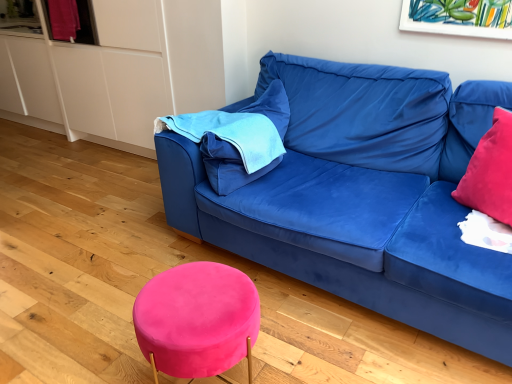
Question: Considering the relative sizes of velvet pink stool at lower center and velvet blue couch at center in the image provided, is velvet pink stool at lower center taller than velvet blue couch at center?

Choices:
 (A) yes
 (B) no

Answer: (B)

Question: Is velvet pink stool at lower center aimed at velvet blue couch at center?

Choices:
 (A) yes
 (B) no

Answer: (B)

Question: Does velvet pink stool at lower center have a lesser height compared to velvet blue couch at center?

Choices:
 (A) no
 (B) yes

Answer: (B)

Question: From the image's perspective, is velvet pink stool at lower center beneath velvet blue couch at center?

Choices:
 (A) no
 (B) yes

Answer: (B)

Question: Are velvet pink stool at lower center and velvet blue couch at center located far from each other?

Choices:
 (A) yes
 (B) no

Answer: (B)

Question: Does velvet pink stool at lower center touch velvet blue couch at center?

Choices:
 (A) no
 (B) yes

Answer: (A)

Question: Considering the relative sizes of velvet blue couch at center and velvet pink stool at lower center in the image provided, is velvet blue couch at center thinner than velvet pink stool at lower center?

Choices:
 (A) yes
 (B) no

Answer: (B)

Question: Is velvet blue couch at center looking in the opposite direction of velvet pink stool at lower center?

Choices:
 (A) no
 (B) yes

Answer: (A)

Question: Does velvet blue couch at center have a greater height compared to velvet pink stool at lower center?

Choices:
 (A) no
 (B) yes

Answer: (B)

Question: Considering the relative sizes of velvet blue couch at center and velvet pink stool at lower center in the image provided, is velvet blue couch at center bigger than velvet pink stool at lower center?

Choices:
 (A) yes
 (B) no

Answer: (A)

Question: Is velvet blue couch at center smaller than velvet pink stool at lower center?

Choices:
 (A) yes
 (B) no

Answer: (B)

Question: From the image's perspective, is velvet blue couch at center located above velvet pink stool at lower center?

Choices:
 (A) no
 (B) yes

Answer: (B)

Question: Is blue fabric pillow at upper left looking in the opposite direction of velvet pink stool at lower center?

Choices:
 (A) yes
 (B) no

Answer: (B)